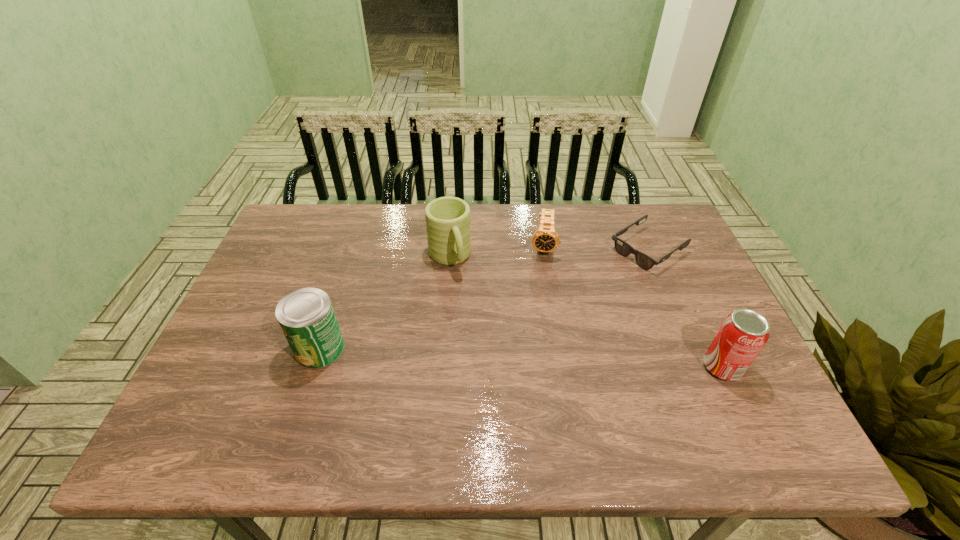
Where is `vacant space at the near right corner`? The height and width of the screenshot is (540, 960). vacant space at the near right corner is located at coordinates (744, 392).

Image resolution: width=960 pixels, height=540 pixels. What are the coordinates of `vacant area between the sunglasses and the third object from left to right` in the screenshot? It's located at (595, 248).

Locate an element on the screen. The width and height of the screenshot is (960, 540). free space between the can and the sunglasses is located at coordinates (484, 299).

What are the coordinates of `free spot between the mug and the watch` in the screenshot? It's located at pyautogui.click(x=496, y=252).

This screenshot has height=540, width=960. Identify the location of empty space between the mug and the second shortest object. (496, 252).

Where is `vacant space in between the shortest object and the soda can`? The image size is (960, 540). vacant space in between the shortest object and the soda can is located at coordinates (684, 308).

The width and height of the screenshot is (960, 540). Identify the location of vacant region between the mug and the soda can. (586, 312).

This screenshot has height=540, width=960. Identify the location of free space between the sunglasses and the soda can. (684, 308).

Find the location of `vacant space that's between the soda can and the leftmost object`. vacant space that's between the soda can and the leftmost object is located at coordinates (521, 357).

Identify the location of free area in between the can and the third object from left to right. (431, 297).